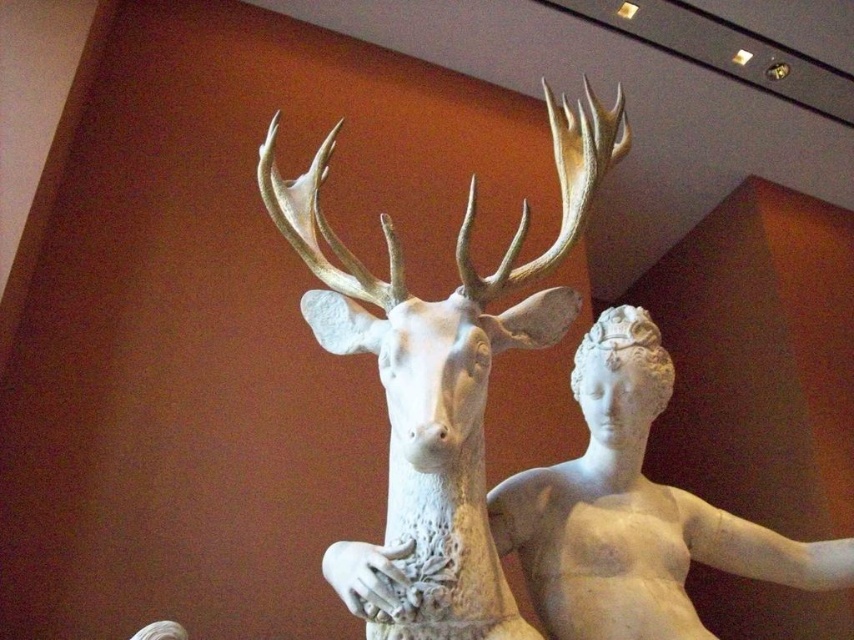
In the scene shown: Who is shorter, white marble deer at center or white marble statue at center?

Standing shorter between the two is white marble statue at center.

Is point (565, 128) positioned before point (540, 516)?

No, (565, 128) is further to viewer.

This screenshot has width=854, height=640. I want to click on white marble deer at center, so click(442, 378).